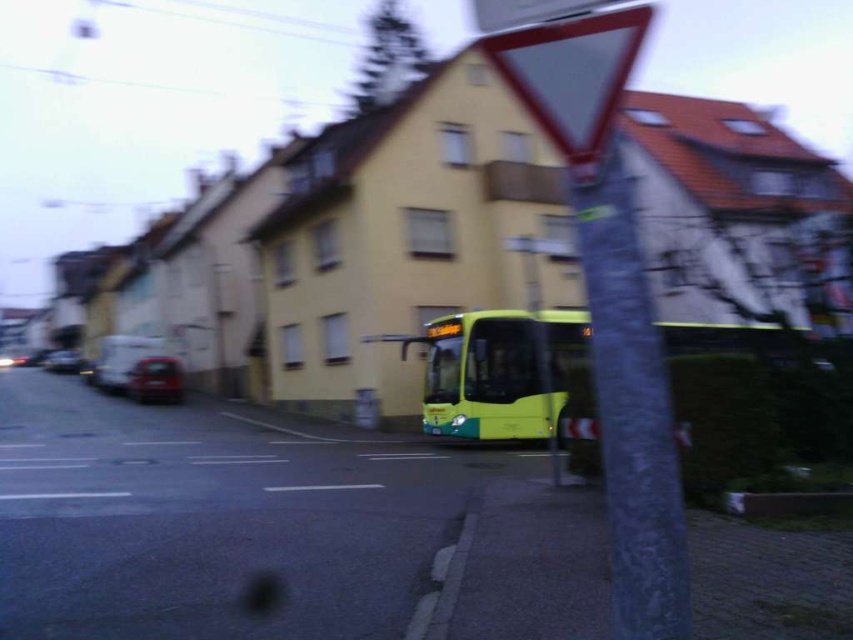
Does green matte bus at center appear under shiny black car at left?

Actually, green matte bus at center is above shiny black car at left.

Is green matte bus at center thinner than shiny black car at left?

Result: Incorrect, green matte bus at center's width is not less than shiny black car at left's.

Where is `green matte bus at center`? This screenshot has width=853, height=640. green matte bus at center is located at coordinates (495, 371).

Looking at this image, is green matte bus at center thinner than shiny red car at lower left?

No.

Is point (676, 337) positioned in front of point (155, 392)?

Yes, it is in front of point (155, 392).

You are a GUI agent. You are given a task and a screenshot of the screen. Output one action in this format:
    pyautogui.click(x=<x>, y=<y>)
    Task: Click on the green matte bus at center
    This screenshot has width=853, height=640.
    Given the screenshot: What is the action you would take?
    pyautogui.click(x=495, y=371)

In order to click on shiny red car at lower left in this screenshot , I will do `click(155, 380)`.

Between shiny red car at lower left and shiny black car at left, which one has less height?

shiny black car at left

I want to click on shiny red car at lower left, so click(155, 380).